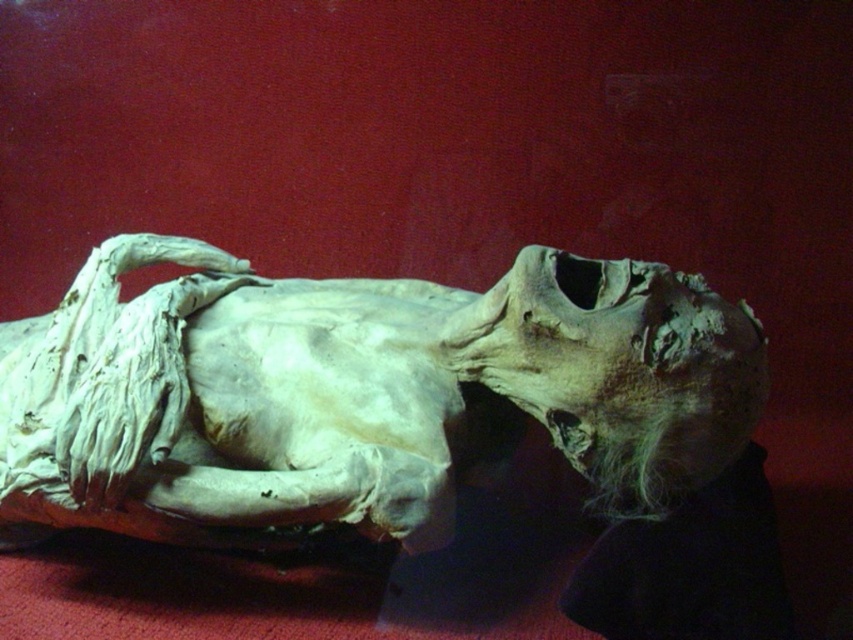
Question: Where is white papier-mâché mummy at center located in relation to grayish-brown bone skull at center in the image?

Choices:
 (A) above
 (B) below

Answer: (B)

Question: Which point is farther to the camera?

Choices:
 (A) white papier-mâché mummy at center
 (B) grayish-brown bone skull at center

Answer: (B)

Question: Is white papier-mâché mummy at center thinner than grayish-brown bone skull at center?

Choices:
 (A) no
 (B) yes

Answer: (A)

Question: Is white papier-mâché mummy at center wider than grayish-brown bone skull at center?

Choices:
 (A) yes
 (B) no

Answer: (A)